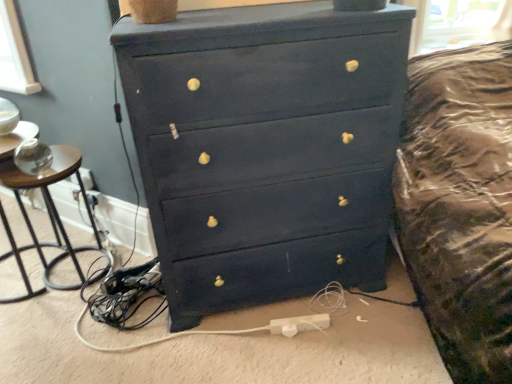
Question: From a real-world perspective, is white plastic extension cord at lower center physically below matte black dresser at center?

Choices:
 (A) no
 (B) yes

Answer: (B)

Question: Considering the relative positions of white plastic extension cord at lower center and matte black dresser at center in the image provided, is white plastic extension cord at lower center in front of matte black dresser at center?

Choices:
 (A) yes
 (B) no

Answer: (B)

Question: Is white plastic extension cord at lower center thinner than matte black dresser at center?

Choices:
 (A) yes
 (B) no

Answer: (A)

Question: Does white plastic extension cord at lower center contain matte black dresser at center?

Choices:
 (A) no
 (B) yes

Answer: (A)

Question: Are white plastic extension cord at lower center and matte black dresser at center making contact?

Choices:
 (A) no
 (B) yes

Answer: (A)

Question: Is the position of white plastic extension cord at lower center more distant than that of matte black dresser at center?

Choices:
 (A) no
 (B) yes

Answer: (B)

Question: Does brown wood side table at left lie in front of white plastic extension cord at lower center?

Choices:
 (A) no
 (B) yes

Answer: (B)

Question: Considering the relative positions of brown wood side table at left and white plastic extension cord at lower center in the image provided, is brown wood side table at left to the right of white plastic extension cord at lower center from the viewer's perspective?

Choices:
 (A) no
 (B) yes

Answer: (A)

Question: From the image's perspective, is brown wood side table at left over white plastic extension cord at lower center?

Choices:
 (A) no
 (B) yes

Answer: (B)

Question: Is brown wood side table at left positioned beyond the bounds of white plastic extension cord at lower center?

Choices:
 (A) no
 (B) yes

Answer: (B)

Question: Does brown wood side table at left have a greater width compared to white plastic extension cord at lower center?

Choices:
 (A) yes
 (B) no

Answer: (A)

Question: Is brown wood side table at left aimed at white plastic extension cord at lower center?

Choices:
 (A) yes
 (B) no

Answer: (B)

Question: Does matte black dresser at center touch brown wood side table at left?

Choices:
 (A) yes
 (B) no

Answer: (B)